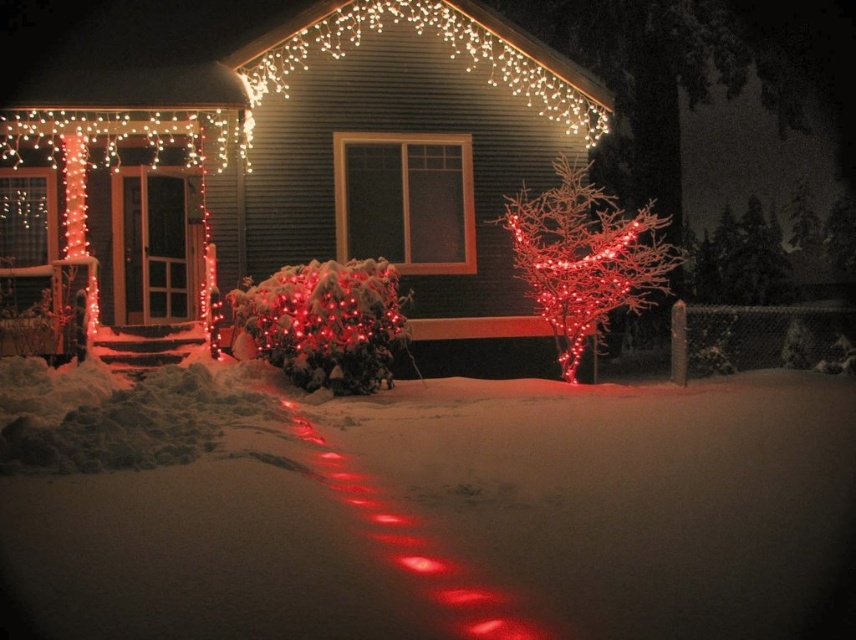
You are standing in front of the house and notice a specific point marked at coordinates (x=435, y=509). What can you find at that exact location?

At point (x=435, y=509) lies white powdery snow at lower center.